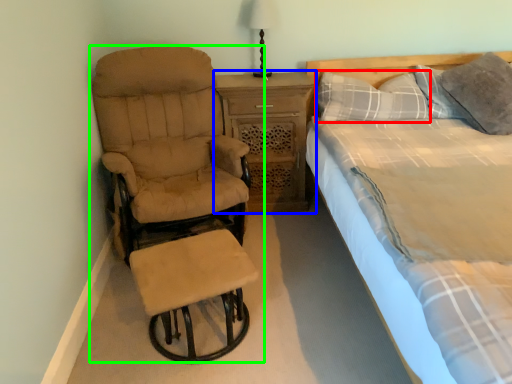
Question: Which is farther away from pillow (highlighted by a red box)? nightstand (highlighted by a blue box) or chair (highlighted by a green box)?

Choices:
 (A) nightstand
 (B) chair

Answer: (B)